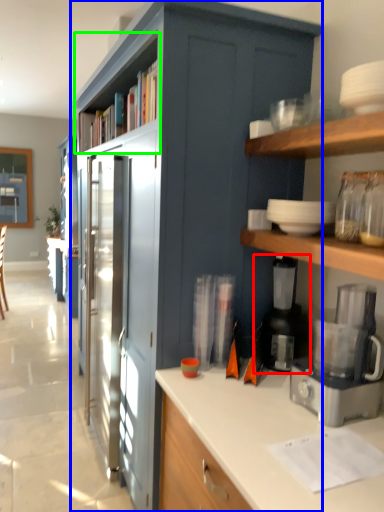
Question: Considering the real-world distances, which object is farthest from appliance (highlighted by a red box)? cabinetry (highlighted by a blue box) or shelf (highlighted by a green box)?

Choices:
 (A) cabinetry
 (B) shelf

Answer: (B)